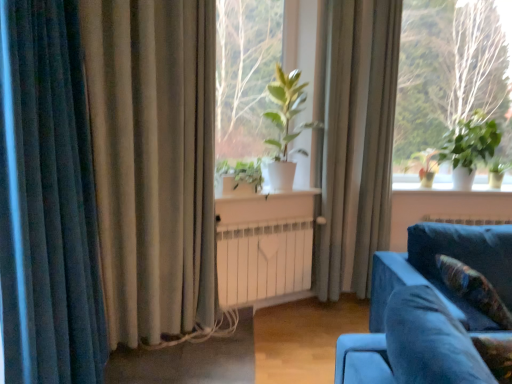
Where is `beige fabric curtain at left, the 2th curtain from the back`? The image size is (512, 384). beige fabric curtain at left, the 2th curtain from the back is located at coordinates (153, 162).

What is the approximate height of green matte plant at center?

The height of green matte plant at center is 38.05 inches.

Describe the element at coordinates (286, 126) in the screenshot. I see `green matte plant at center` at that location.

This screenshot has height=384, width=512. Identify the location of green matte plant at center, the second plant positioned from the back. (242, 173).

The width and height of the screenshot is (512, 384). I want to click on white plastic window sill at right, so click(x=422, y=188).

Does white matte radiator at center have a greater height compared to green matte plant at center, which ranks as the 1th plant in left-to-right order?

Yes, white matte radiator at center is taller than green matte plant at center, which ranks as the 1th plant in left-to-right order.

Based on the photo, from the image's perspective, is white matte radiator at center located above green matte plant at center, the second plant in the right-to-left sequence?

No, from the image's perspective, white matte radiator at center is not above green matte plant at center, the second plant in the right-to-left sequence.

Based on the photo, from a real-world perspective, is white matte radiator at center physically above green matte plant at center, the second plant positioned from the back?

No, from a real-world perspective, white matte radiator at center is not on top of green matte plant at center, the second plant positioned from the back.

Is green matte plant at center bigger than white plastic window sill at right?

Correct, green matte plant at center is larger in size than white plastic window sill at right.

From the image's perspective, does green matte plant at center appear higher than white plastic window sill at right?

Indeed, from the image's perspective, green matte plant at center is shown above white plastic window sill at right.

Are green matte plant at center and white plastic window sill at right far apart?

Yes, green matte plant at center is far from white plastic window sill at right.

Considering the relative sizes of green matte plant at center and white plastic window sill at right in the image provided, is green matte plant at center thinner than white plastic window sill at right?

In fact, green matte plant at center might be wider than white plastic window sill at right.

From the image's perspective, who appears lower, green leafy plant at center or green matte plant at center, which ranks as the 1th plant in left-to-right order?

green matte plant at center, which ranks as the 1th plant in left-to-right order.

Which is in front, point (247, 83) or point (238, 162)?

Positioned in front is point (238, 162).

Between green leafy plant at center and green matte plant at center, the second plant positioned from the back, which one appears on the right side from the viewer's perspective?

From the viewer's perspective, green leafy plant at center appears more on the right side.

Between green leafy plant at center and green matte plant at center, the second plant positioned from the back, which one has more height?

green leafy plant at center is taller.

Between point (436, 234) and point (475, 192), which one is positioned in front?

The point (436, 234) is closer to the camera.

Based on their sizes in the image, would you say velvet blue couch at lower right is bigger or smaller than white plastic window sill at right?

velvet blue couch at lower right is bigger than white plastic window sill at right.

Is velvet blue couch at lower right turned away from white plastic window sill at right?

That's right, velvet blue couch at lower right is facing away from white plastic window sill at right.

Is velvet blue couch at lower right far away from white plastic window sill at right?

Yes, velvet blue couch at lower right and white plastic window sill at right are quite far apart.

Which object is closer to the camera, green matte plant at right, which is counted as the second plant, starting from the front, or white plastic window sill at right?

green matte plant at right, which is counted as the second plant, starting from the front, is in front.

Between green matte plant at right, arranged as the 1th plant when viewed from the back, and white plastic window sill at right, which one appears on the left side from the viewer's perspective?

white plastic window sill at right.

Measure the distance between green matte plant at right, arranged as the 1th plant when viewed from the back, and white plastic window sill at right.

The distance of green matte plant at right, arranged as the 1th plant when viewed from the back, from white plastic window sill at right is 12.61 inches.

Can you confirm if green matte plant at right, arranged as the 1th plant when viewed from the back, is shorter than white plastic window sill at right?

Incorrect, the height of green matte plant at right, arranged as the 1th plant when viewed from the back, does not fall short of that of white plastic window sill at right.

Is green leafy plant at upper right spatially inside silky beige curtain at center, the third curtain when ordered from left to right, or outside of it?

green leafy plant at upper right cannot be found inside silky beige curtain at center, the third curtain when ordered from left to right.

How many degrees apart are the facing directions of green leafy plant at upper right and silky beige curtain at center, the 3th curtain when ordered from front to back?

28.3 degrees.

From the image's perspective, is green leafy plant at upper right located above or below silky beige curtain at center, which is the 1th curtain from right to left?

Clearly, from the image's perspective, green leafy plant at upper right is above silky beige curtain at center, which is the 1th curtain from right to left.

Is green leafy plant at upper right further to the viewer compared to silky beige curtain at center, the 3th curtain when ordered from front to back?

Yes, it is.

From the image's perspective, is velvet blue couch at lower right below dark blue velvet curtain at left, the first curtain when ordered from left to right?

Correct, velvet blue couch at lower right appears lower than dark blue velvet curtain at left, the first curtain when ordered from left to right, in the image.

Is velvet blue couch at lower right turned away from dark blue velvet curtain at left, marked as the 3th curtain in a back-to-front arrangement?

No, velvet blue couch at lower right's orientation is not away from dark blue velvet curtain at left, marked as the 3th curtain in a back-to-front arrangement.

Does velvet blue couch at lower right have a lesser height compared to dark blue velvet curtain at left, the first curtain when ordered from left to right?

Yes, velvet blue couch at lower right is shorter than dark blue velvet curtain at left, the first curtain when ordered from left to right.

Is velvet blue couch at lower right at the left side of dark blue velvet curtain at left, which appears as the third curtain when viewed from the right?

No.

What are the coordinates of `table that is on the right side of green matte plant at center, which ranks as the 1th plant in left-to-right order` in the screenshot? It's located at (265, 247).

At what (x,y) coordinates should I click in order to perform the action: click on window sill below the green matte plant at center (from a real-world perspective). Please return your answer as a coordinate pair (x, y). Looking at the image, I should click on (422, 188).

When comparing their distances from silky beige curtain at center, the 3th curtain when ordered from front to back, does white plastic window sill at right or velvet floral pillow at lower right seem further?

velvet floral pillow at lower right is positioned further to the anchor silky beige curtain at center, the 3th curtain when ordered from front to back.

Based on their spatial positions, is beige fabric curtain at left, the 2th curtain from the back, or green matte plant at center, the second plant in the right-to-left sequence, further from white plastic window sill at right?

The object further to white plastic window sill at right is beige fabric curtain at left, the 2th curtain from the back.

Considering their positions, is green matte plant at right, arranged as the 2th plant when viewed from the left, positioned further to green leafy plant at center than velvet blue couch at lower right?

velvet blue couch at lower right is positioned further to the anchor green leafy plant at center.

Which object lies nearer to the anchor point green matte plant at center, green matte plant at right, arranged as the 1th plant when viewed from the back, or dark blue velvet curtain at left, marked as the 3th curtain in a back-to-front arrangement?

Based on the image, green matte plant at right, arranged as the 1th plant when viewed from the back, appears to be nearer to green matte plant at center.

From the image, which object appears to be nearer to velvet floral pillow at lower right, silky beige curtain at center, which is the 1th curtain from right to left, or green matte plant at center?

silky beige curtain at center, which is the 1th curtain from right to left, is positioned closer to the anchor velvet floral pillow at lower right.

Estimate the real-world distances between objects in this image. Which object is closer to white matte radiator at center, green matte plant at right, marked as the 1th plant in a right-to-left arrangement, or green matte plant at center, the 1th plant viewed from the front?

Among the two, green matte plant at center, the 1th plant viewed from the front, is located nearer to white matte radiator at center.

Which object lies further to the anchor point silky beige curtain at center, the 1th curtain viewed from the back, velvet blue couch at lower right or green matte plant at center, the second plant positioned from the back?

velvet blue couch at lower right is positioned further to the anchor silky beige curtain at center, the 1th curtain viewed from the back.

From the image, which object appears to be nearer to silky beige curtain at center, the 3th curtain when ordered from front to back, green leafy plant at upper right or white matte radiator at center?

white matte radiator at center lies closer to silky beige curtain at center, the 3th curtain when ordered from front to back, than the other object.

In order to click on houseplant located between dark blue velvet curtain at left, which appears as the third curtain when viewed from the right, and white plastic window sill at right in the left-right direction in this screenshot , I will do `click(286, 126)`.

The image size is (512, 384). I want to click on curtain located between green matte plant at center, the second plant positioned from the back, and green leafy plant at upper right in the left-right direction, so click(357, 142).

Where is `studio couch located between green matte plant at center, the second plant positioned from the back, and green matte plant at right, marked as the 1th plant in a right-to-left arrangement, in the left-right direction`? This screenshot has height=384, width=512. studio couch located between green matte plant at center, the second plant positioned from the back, and green matte plant at right, marked as the 1th plant in a right-to-left arrangement, in the left-right direction is located at coordinates (429, 287).

You are a GUI agent. You are given a task and a screenshot of the screen. Output one action in this format:
    pyautogui.click(x=<x>, y=<y>)
    Task: Click on the houseplant between dark blue velvet curtain at left, marked as the 3th curtain in a back-to-front arrangement, and green matte plant at right, which is counted as the second plant, starting from the front, in the horizontal direction
    The width and height of the screenshot is (512, 384).
    Given the screenshot: What is the action you would take?
    pyautogui.click(x=286, y=126)